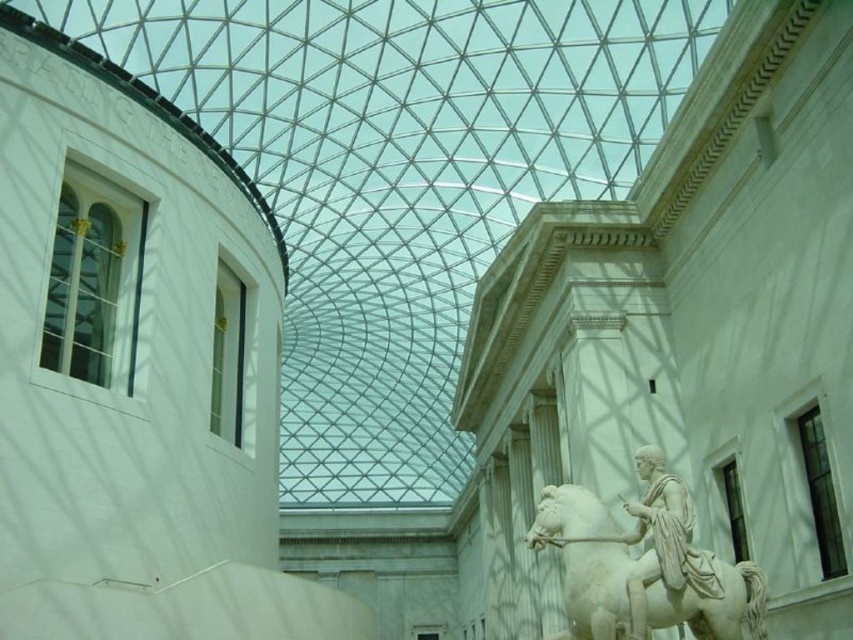
Question: Is white marble horse at center-right below white marble statue at center-right?

Choices:
 (A) no
 (B) yes

Answer: (B)

Question: Is white marble horse at center-right thinner than white marble statue at center-right?

Choices:
 (A) no
 (B) yes

Answer: (A)

Question: Among these objects, which one is nearest to the camera?

Choices:
 (A) white marble statue at center-right
 (B) white marble horse at center-right

Answer: (A)

Question: Does white marble horse at center-right have a lesser width compared to white marble statue at center-right?

Choices:
 (A) no
 (B) yes

Answer: (A)